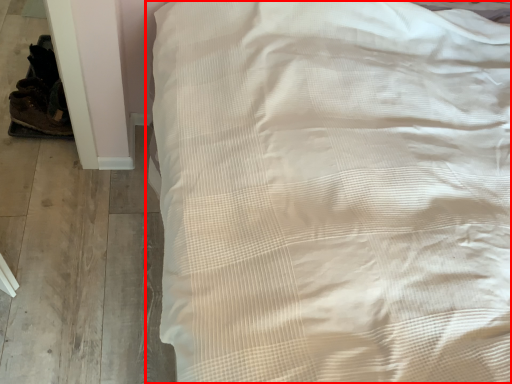
Question: Considering the relative positions of bed (annotated by the red box) and shoe in the image provided, where is bed (annotated by the red box) located with respect to the staircase?

Choices:
 (A) right
 (B) left

Answer: (A)